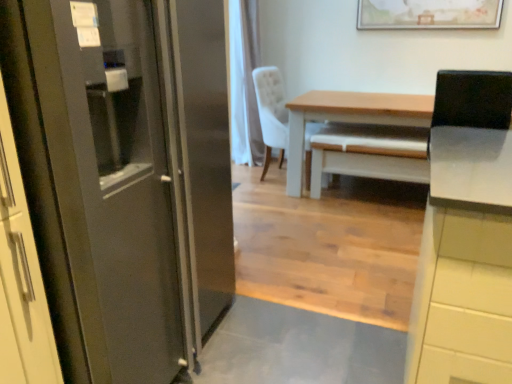
Question: From a real-world perspective, is wooden framed artwork at upper center beneath light brown wooden table at center?

Choices:
 (A) no
 (B) yes

Answer: (A)

Question: Is wooden framed artwork at upper center taller than light brown wooden table at center?

Choices:
 (A) yes
 (B) no

Answer: (B)

Question: Is wooden framed artwork at upper center oriented away from light brown wooden table at center?

Choices:
 (A) yes
 (B) no

Answer: (B)

Question: From the image's perspective, is wooden framed artwork at upper center on light brown wooden table at center?

Choices:
 (A) no
 (B) yes

Answer: (B)

Question: Can you confirm if wooden framed artwork at upper center is shorter than light brown wooden table at center?

Choices:
 (A) no
 (B) yes

Answer: (B)

Question: Considering their positions, is wooden framed artwork at upper center located in front of or behind white glossy cabinet at upper right?

Choices:
 (A) behind
 (B) front

Answer: (A)

Question: In terms of height, does wooden framed artwork at upper center look taller or shorter compared to white glossy cabinet at upper right?

Choices:
 (A) tall
 (B) short

Answer: (B)

Question: Is point (437, 24) closer or farther from the camera than point (484, 380)?

Choices:
 (A) closer
 (B) farther

Answer: (B)

Question: Is wooden framed artwork at upper center to the left or to the right of white glossy cabinet at upper right in the image?

Choices:
 (A) left
 (B) right

Answer: (B)

Question: From a real-world perspective, is satin metallic refrigerator at left positioned above or below wooden framed artwork at upper center?

Choices:
 (A) below
 (B) above

Answer: (A)

Question: Is satin metallic refrigerator at left taller or shorter than wooden framed artwork at upper center?

Choices:
 (A) tall
 (B) short

Answer: (A)

Question: In terms of width, does satin metallic refrigerator at left look wider or thinner when compared to wooden framed artwork at upper center?

Choices:
 (A) wide
 (B) thin

Answer: (A)

Question: Is satin metallic refrigerator at left situated inside wooden framed artwork at upper center or outside?

Choices:
 (A) outside
 (B) inside

Answer: (A)

Question: Is white glossy cabinet at upper right taller or shorter than wooden framed artwork at upper center?

Choices:
 (A) short
 (B) tall

Answer: (B)

Question: Is white glossy cabinet at upper right wider or thinner than wooden framed artwork at upper center?

Choices:
 (A) wide
 (B) thin

Answer: (A)